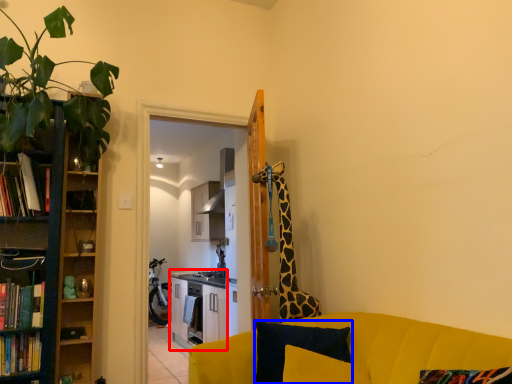
Question: Which object appears farthest to the camera in this image, entertainment center (highlighted by a red box) or pillow (highlighted by a blue box)?

Choices:
 (A) entertainment center
 (B) pillow

Answer: (A)